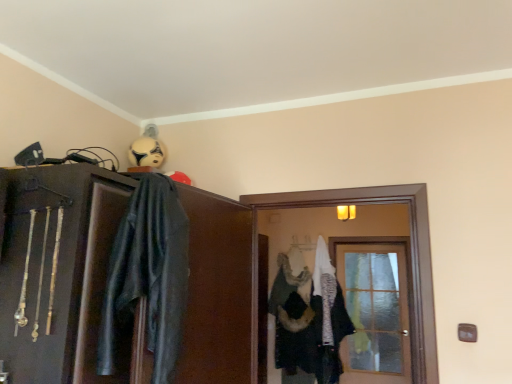
Question: From a real-world perspective, is matte black cabinet at upper left on fur-like fabric hanger at center?

Choices:
 (A) yes
 (B) no

Answer: (B)

Question: Considering the relative positions of matte black cabinet at upper left and fur-like fabric hanger at center in the image provided, is matte black cabinet at upper left behind fur-like fabric hanger at center?

Choices:
 (A) yes
 (B) no

Answer: (B)

Question: From the image's perspective, would you say matte black cabinet at upper left is positioned over fur-like fabric hanger at center?

Choices:
 (A) no
 (B) yes

Answer: (B)

Question: Is matte black cabinet at upper left to the left of fur-like fabric hanger at center from the viewer's perspective?

Choices:
 (A) yes
 (B) no

Answer: (A)

Question: Is matte black cabinet at upper left positioned in front of fur-like fabric hanger at center?

Choices:
 (A) no
 (B) yes

Answer: (B)

Question: From their relative heights in the image, would you say white fuzzy coat at center is taller or shorter than translucent glass door at center?

Choices:
 (A) tall
 (B) short

Answer: (A)

Question: From the image's perspective, relative to translucent glass door at center, is white fuzzy coat at center above or below?

Choices:
 (A) above
 (B) below

Answer: (B)

Question: Is white fuzzy coat at center inside or outside of translucent glass door at center?

Choices:
 (A) outside
 (B) inside

Answer: (A)

Question: In terms of width, does white fuzzy coat at center look wider or thinner when compared to translucent glass door at center?

Choices:
 (A) wide
 (B) thin

Answer: (A)

Question: From a real-world perspective, relative to fur-like fabric hanger at center, is dark gray leather jacket at upper left vertically above or below?

Choices:
 (A) above
 (B) below

Answer: (B)

Question: Does point (159, 329) appear closer or farther from the camera than point (295, 248)?

Choices:
 (A) farther
 (B) closer

Answer: (B)

Question: Is dark gray leather jacket at upper left taller or shorter than fur-like fabric hanger at center?

Choices:
 (A) tall
 (B) short

Answer: (A)

Question: Looking at the image, does dark gray leather jacket at upper left seem bigger or smaller compared to fur-like fabric hanger at center?

Choices:
 (A) big
 (B) small

Answer: (A)

Question: In the image, is white matte helmet at upper center on the left side or the right side of fur-like fabric hanger at center?

Choices:
 (A) right
 (B) left

Answer: (B)

Question: Is white matte helmet at upper center in front of or behind fur-like fabric hanger at center in the image?

Choices:
 (A) behind
 (B) front

Answer: (B)